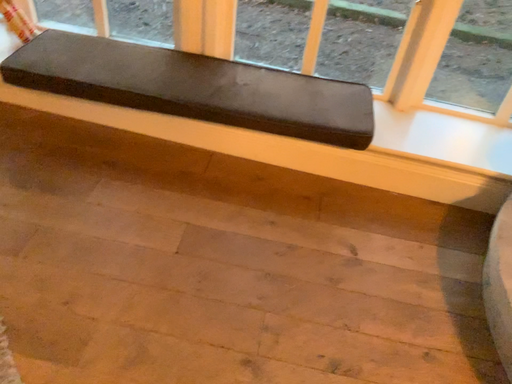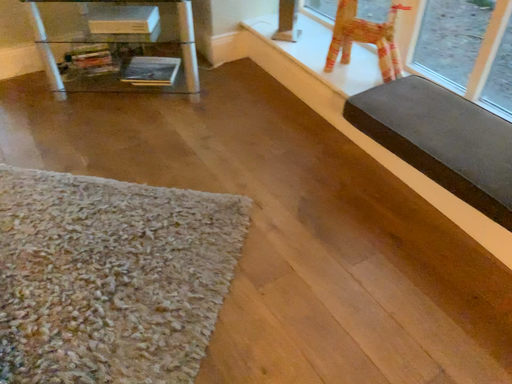
Question: Which way did the camera rotate in the video?

Choices:
 (A) rotated right
 (B) rotated left

Answer: (B)